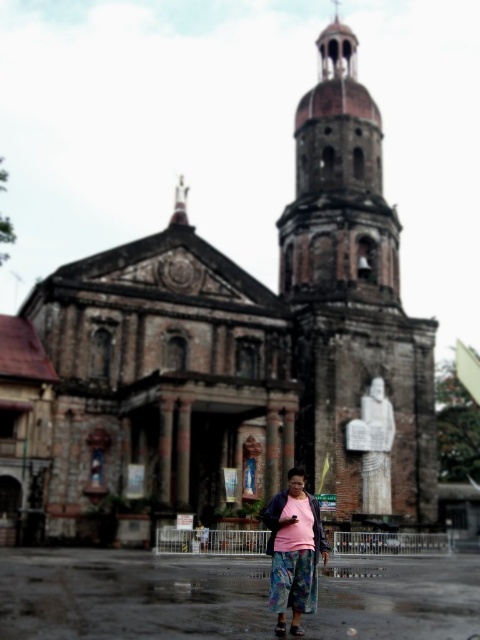
Question: Estimate the real-world distances between objects in this image. Which object is farther from the brown stone bell tower at upper right?

Choices:
 (A) brown stone tower at center
 (B) pink fabric at center

Answer: (B)

Question: Is brown stone bell tower at upper right above pink fabric at center?

Choices:
 (A) no
 (B) yes

Answer: (B)

Question: Is brown stone bell tower at upper right further to camera compared to pink fabric at center?

Choices:
 (A) yes
 (B) no

Answer: (A)

Question: Which point is closer to the camera?

Choices:
 (A) pink fabric at center
 (B) brown stone tower at center
 (C) brown stone bell tower at upper right

Answer: (A)

Question: Which object is the farthest from the brown stone bell tower at upper right?

Choices:
 (A) pink fabric at center
 (B) brown stone tower at center

Answer: (A)

Question: Can you confirm if brown stone bell tower at upper right is positioned above pink fabric at center?

Choices:
 (A) no
 (B) yes

Answer: (B)